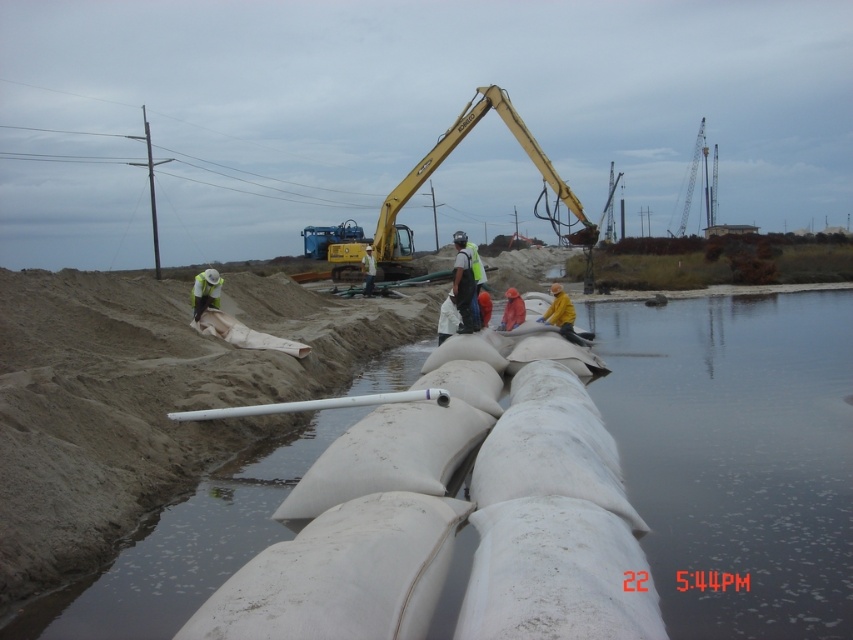
Consider the image. Does clear water at lower right have a greater height compared to reflective silver helmet at center?

Yes, clear water at lower right is taller than reflective silver helmet at center.

In the scene shown: Is clear water at lower right thinner than reflective silver helmet at center?

In fact, clear water at lower right might be wider than reflective silver helmet at center.

The height and width of the screenshot is (640, 853). I want to click on clear water at lower right, so click(737, 456).

Who is taller, yellow metallic excavator at center or reflective silver helmet at center?

yellow metallic excavator at center is taller.

Can you confirm if yellow metallic excavator at center is smaller than reflective silver helmet at center?

No.

Describe the element at coordinates (440, 163) in the screenshot. This screenshot has height=640, width=853. I see `yellow metallic excavator at center` at that location.

The image size is (853, 640). I want to click on yellow metallic excavator at center, so click(x=440, y=163).

Is clear water at lower right smaller than white matte pipe at center?

Actually, clear water at lower right might be larger than white matte pipe at center.

Is point (846, 467) less distant than point (421, 400)?

That is True.

You are a GUI agent. You are given a task and a screenshot of the screen. Output one action in this format:
    pyautogui.click(x=<x>, y=<y>)
    Task: Click on the clear water at lower right
    This screenshot has width=853, height=640.
    Given the screenshot: What is the action you would take?
    pyautogui.click(x=737, y=456)